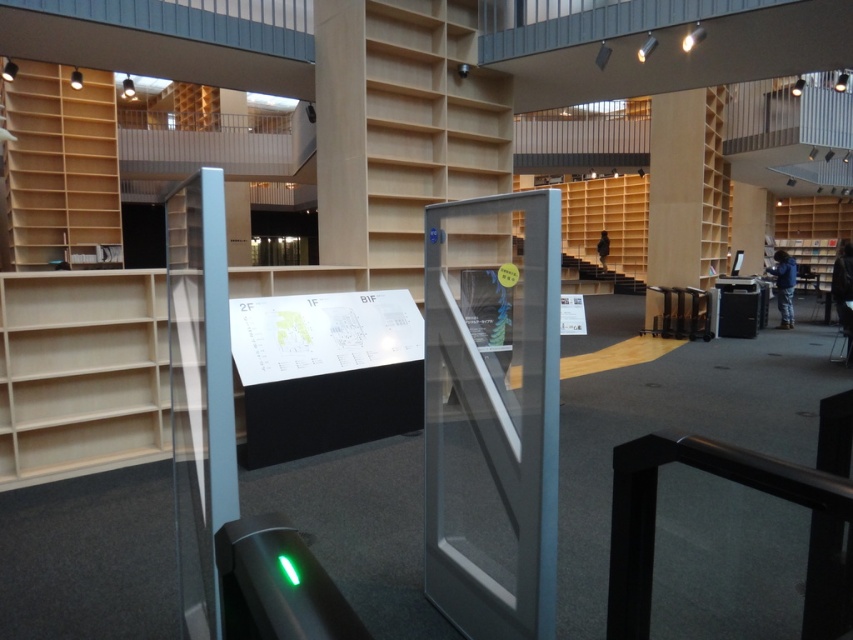
Is transparent glass door at center below wooden bookshelf at right?

Yes, transparent glass door at center is below wooden bookshelf at right.

Can you confirm if transparent glass door at center is positioned to the left of wooden bookshelf at right?

Yes, transparent glass door at center is to the left of wooden bookshelf at right.

Find the location of a particular element. transparent glass door at center is located at coordinates (492, 412).

Who is positioned more to the right, wooden at upper center or wooden bookshelf at right?

Positioned to the right is wooden bookshelf at right.

Between wooden at upper center and wooden bookshelf at right, which one is positioned lower?

Positioned lower is wooden bookshelf at right.

Which is in front, point (636, 179) or point (824, 224)?

Point (636, 179) is more forward.

Locate an element on the screen. wooden at upper center is located at coordinates (606, 228).

In the scene shown: Can you confirm if light wood bookshelf at center is positioned below wooden shelves at upper left?

Yes.

Which of these two, light wood bookshelf at center or wooden shelves at upper left, stands shorter?

light wood bookshelf at center

Which is behind, point (71, 353) or point (109, 120)?

The point (109, 120) is behind.

Locate an element on the screen. This screenshot has height=640, width=853. light wood bookshelf at center is located at coordinates (80, 372).